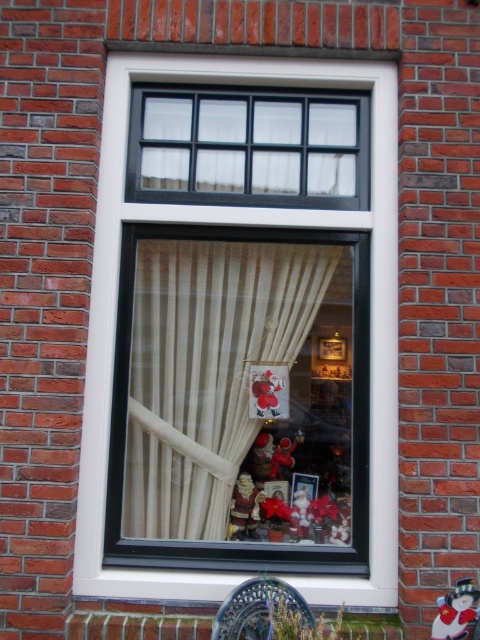
Question: Considering the real-world distances, which object is closest to the white matte santa at center?

Choices:
 (A) matte brown figurine at center
 (B) matte red santa at lower right
 (C) white plastic window at center

Answer: (A)

Question: Which object appears closest to the camera in this image?

Choices:
 (A) matte brown figurine at center
 (B) white plastic window at center
 (C) white matte santa at center
 (D) beige sheer curtain at center

Answer: (B)

Question: Considering the real-world distances, which object is closest to the matte red santa at lower right?

Choices:
 (A) white matte santa at center
 (B) matte brown figurine at center

Answer: (A)

Question: Is white plastic window at center smaller than matte red santa at lower right?

Choices:
 (A) yes
 (B) no

Answer: (B)

Question: Does white plastic window at center have a smaller size compared to matte red santa at lower right?

Choices:
 (A) no
 (B) yes

Answer: (A)

Question: Is matte red santa at lower right thinner than white matte santa at center?

Choices:
 (A) no
 (B) yes

Answer: (A)